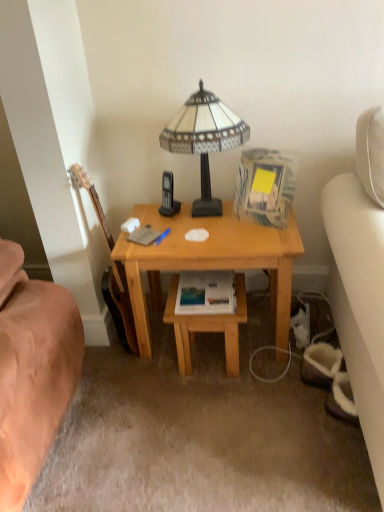
Where is `vacant space to the left of wooden acoustic guitar at left`? vacant space to the left of wooden acoustic guitar at left is located at coordinates (97, 355).